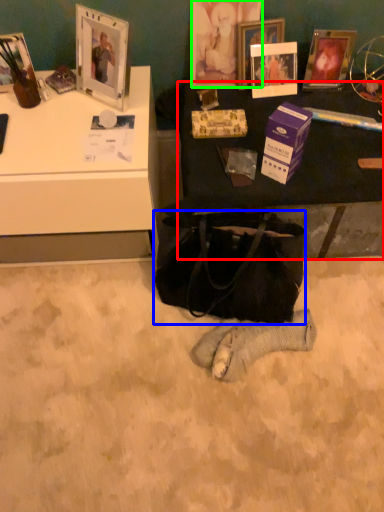
Question: Considering the real-world distances, which object is closest to table (highlighted by a red box)? handbag (highlighted by a blue box) or picture frame (highlighted by a green box).

Choices:
 (A) handbag
 (B) picture frame

Answer: (A)